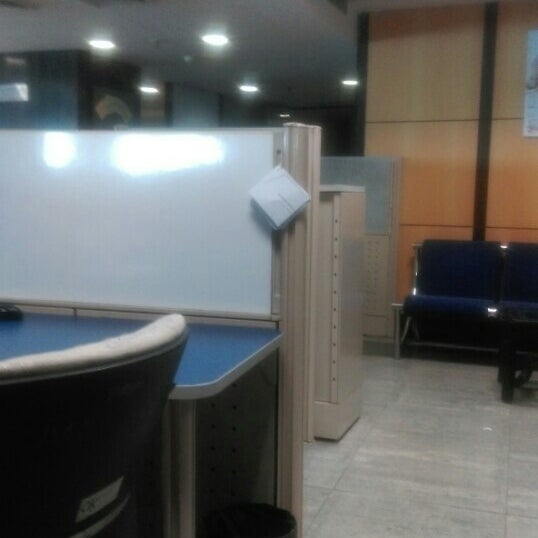
Identify the location of cubicle. (292, 393).